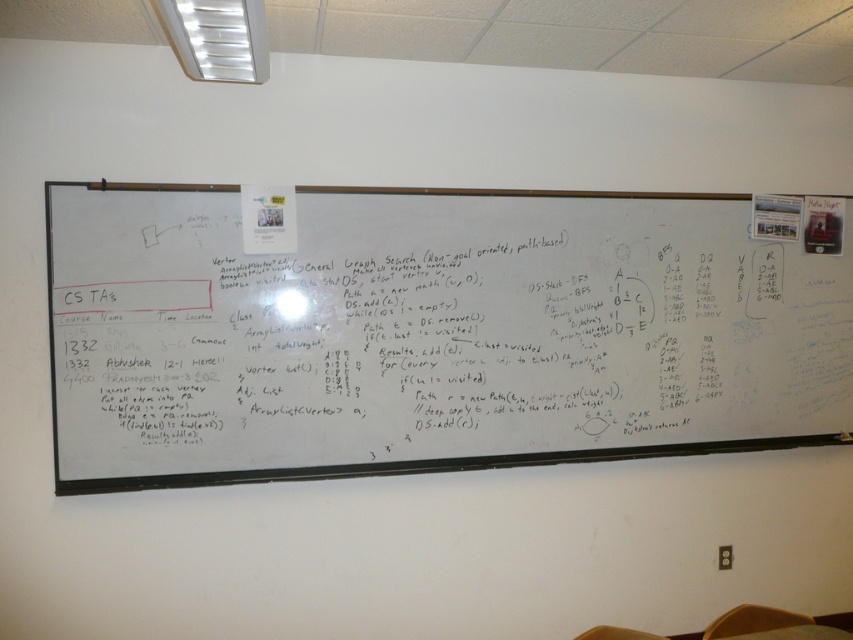
Question: Among these points, which one is farthest from the camera?

Choices:
 (A) (705, 637)
 (B) (636, 637)

Answer: (A)

Question: Can you confirm if whiteboard at center is wider than brown wood chair at lower center?

Choices:
 (A) no
 (B) yes

Answer: (B)

Question: Among these points, which one is farthest from the camera?

Choices:
 (A) (175, 310)
 (B) (724, 636)
 (C) (630, 632)

Answer: (A)

Question: Is whiteboard at center positioned before brown wood chair at lower center?

Choices:
 (A) yes
 (B) no

Answer: (B)

Question: Estimate the real-world distances between objects in this image. Which object is closer to the whiteboard at center?

Choices:
 (A) brown wood chair at lower center
 (B) yellow fabric chair at lower right

Answer: (B)

Question: Observing the image, what is the correct spatial positioning of whiteboard at center in reference to brown wood chair at lower center?

Choices:
 (A) above
 (B) below

Answer: (A)